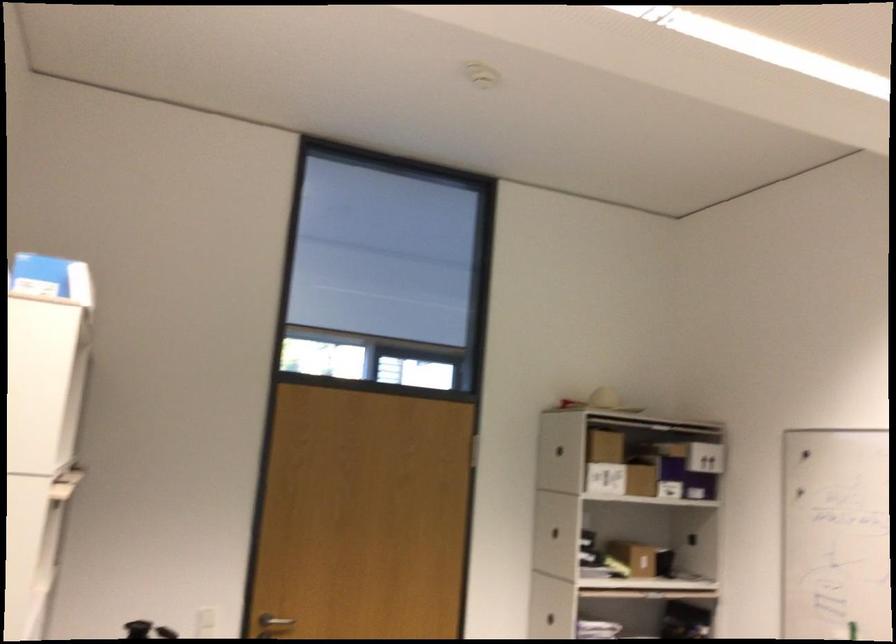
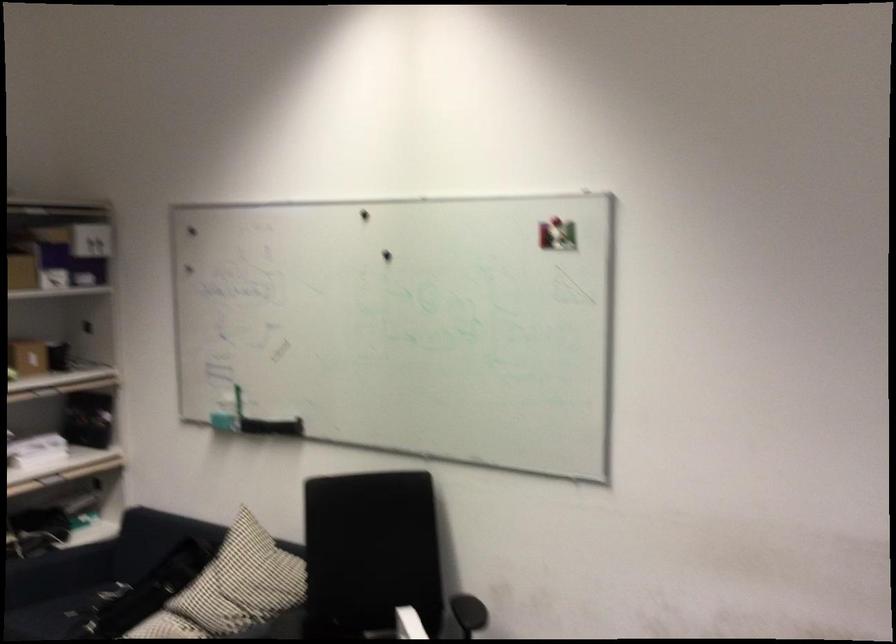
Locate, in the second image, the point that corresponds to (815,451) in the first image.

(192, 231)